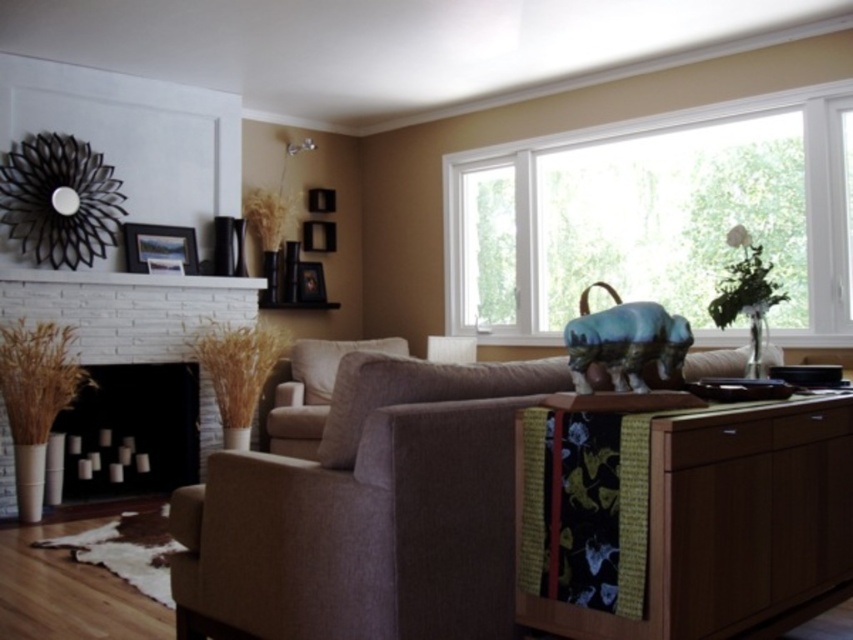
You are planning to move a 1.2 meter wide sofa into the living room. The current brown fabric couch at center is in the way. Can you slide the new sofa past the wooden picture frame at upper left without hitting it?

The brown fabric couch at center might be wider than wooden picture frame at upper left, so it is uncertain if the new sofa can pass without hitting the frame. Check the exact width of the couch first.

You are arranging a new piece of furniture in the living room and need to place it between the black matte fireplace at center and the wooden picture frame at upper left. Based on their positions, which object should you place the new furniture closer to if you want it to be aligned with the right side of the room?

You should place the new furniture closer to the wooden picture frame at upper left because the black matte fireplace at center is positioned on the left side of the wooden picture frame at upper left, meaning the wooden picture frame is further to the right in the room.